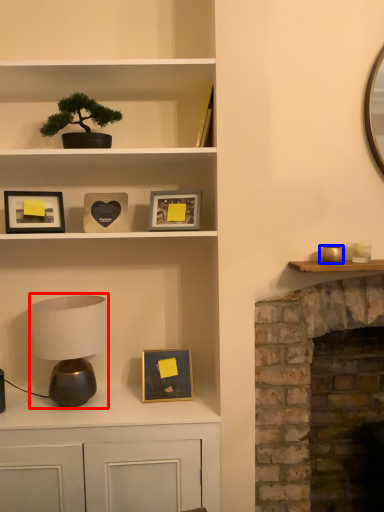
Question: Which of the following is the farthest to the observer, table lamp (highlighted by a red box) or candle holder (highlighted by a blue box)?

Choices:
 (A) table lamp
 (B) candle holder

Answer: (A)